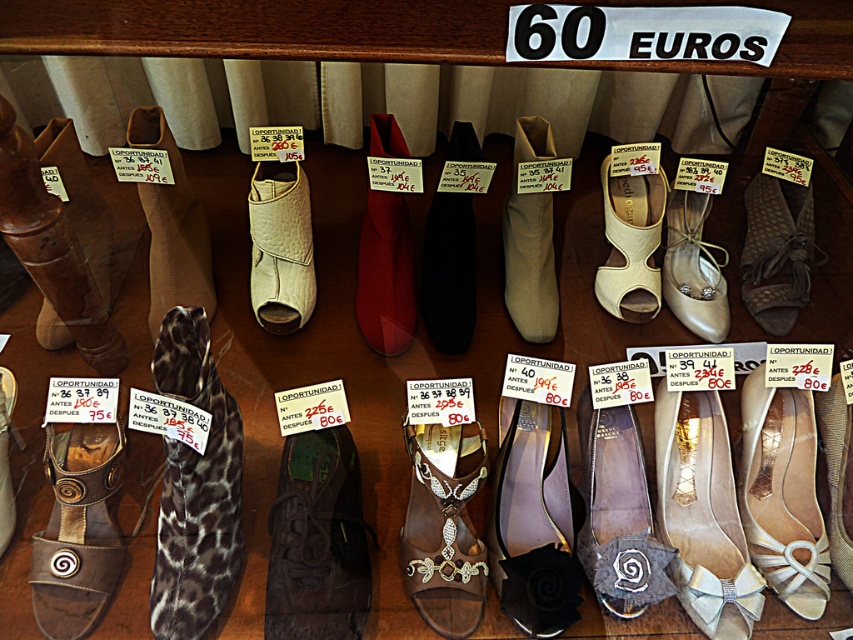
Does matte leather shoe at center have a greater width compared to leopard print sandal at center?

Yes.

Identify the location of matte leather shoe at center. The width and height of the screenshot is (853, 640). (386, 273).

Between satin beige flat at center right and satin beige shoe at center, which one has less height?

satin beige shoe at center

Can you confirm if satin beige flat at center right is shorter than satin beige shoe at center?

Incorrect, satin beige flat at center right's height does not fall short of satin beige shoe at center's.

Is point (759, 557) more distant than point (672, 262)?

No, (759, 557) is in front of (672, 262).

At what (x,y) coordinates should I click in order to perform the action: click on satin beige flat at center right. Please return your answer as a coordinate pair (x, y). The width and height of the screenshot is (853, 640). Looking at the image, I should click on (782, 493).

Which is more to the left, black leather sandal at center or brown leather boot at left?

brown leather boot at left

Image resolution: width=853 pixels, height=640 pixels. What do you see at coordinates (531, 525) in the screenshot?
I see `black leather sandal at center` at bounding box center [531, 525].

Where is `black leather sandal at center`? black leather sandal at center is located at coordinates (531, 525).